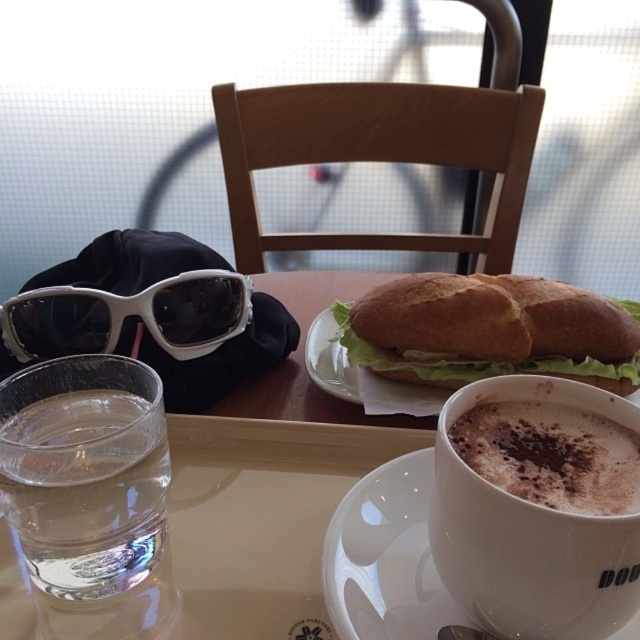
Is point (410, 545) closer to camera compared to point (54, 339)?

Yes.

Which is behind, point (413, 536) or point (99, 298)?

Positioned behind is point (99, 298).

Which is behind, point (412, 628) or point (112, 305)?

The point (112, 305) is behind.

The image size is (640, 640). Identify the location of white ceramic saucer at center. (385, 557).

This screenshot has height=640, width=640. Describe the element at coordinates (456, 339) in the screenshot. I see `brown bread sandwich at center` at that location.

Can you confirm if brown bread sandwich at center is positioned below white glossy saucer at center?

Actually, brown bread sandwich at center is above white glossy saucer at center.

Describe the element at coordinates (456, 339) in the screenshot. I see `brown bread sandwich at center` at that location.

The image size is (640, 640). Identify the location of brown bread sandwich at center. pyautogui.click(x=456, y=339).

Is clear glass water at lower left wider than brown bread sandwich at center?

Incorrect, clear glass water at lower left's width does not surpass brown bread sandwich at center's.

Who is more distant from viewer, (156, 518) or (426, 340)?

The point (426, 340) is more distant.

You are a GUI agent. You are given a task and a screenshot of the screen. Output one action in this format:
    pyautogui.click(x=<x>, y=<y>)
    Task: Click on the clear glass water at lower left
    The image size is (640, 640).
    Given the screenshot: What is the action you would take?
    click(86, 490)